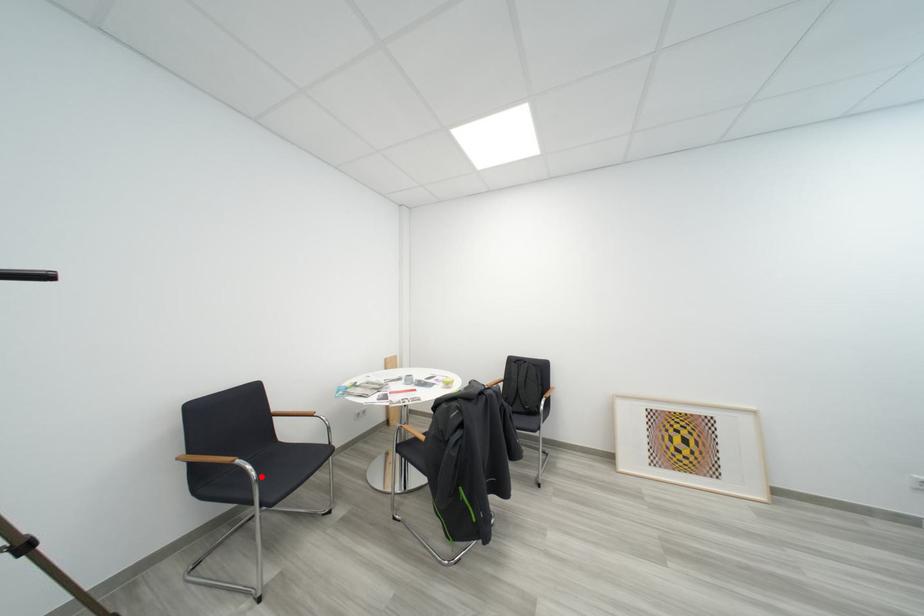
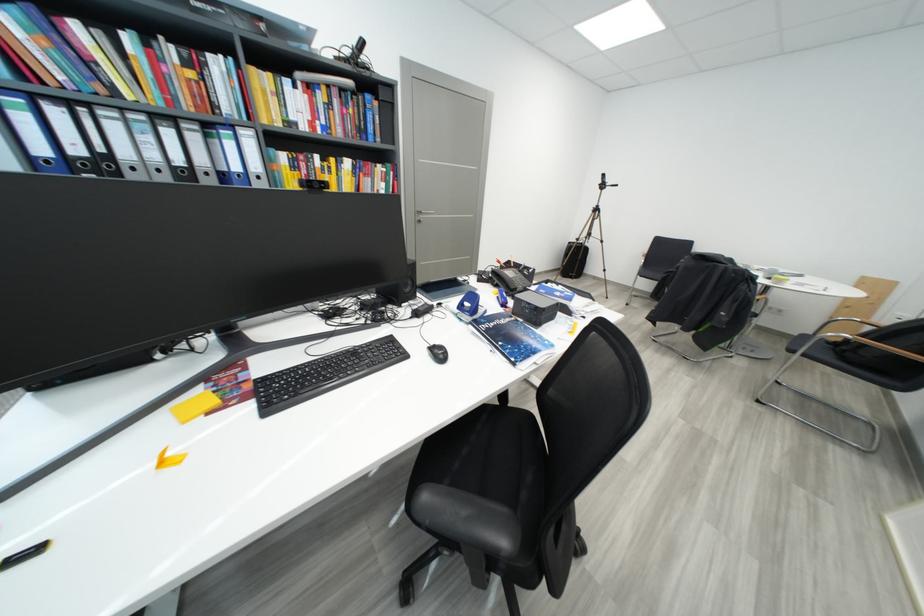
Question: A red point is marked in image1. In image2, is the corresponding 3D point closer to the camera or farther? Reply with the corresponding letter.

Choices:
 (A) The corresponding 3D point is closer.
 (B) The corresponding 3D point is farther.

Answer: (A)